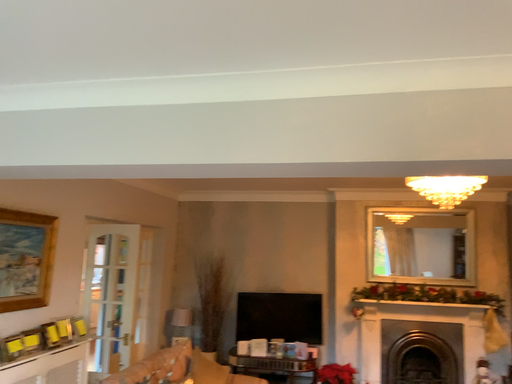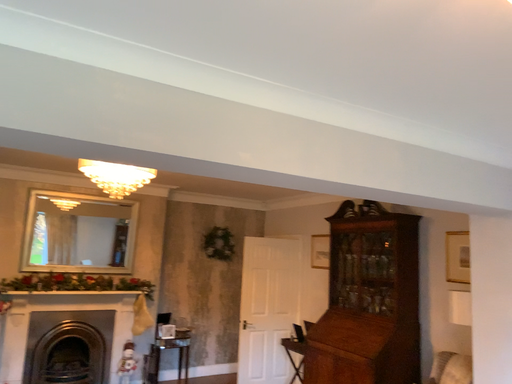
Question: Which way did the camera rotate in the video?

Choices:
 (A) rotated left
 (B) rotated right

Answer: (B)